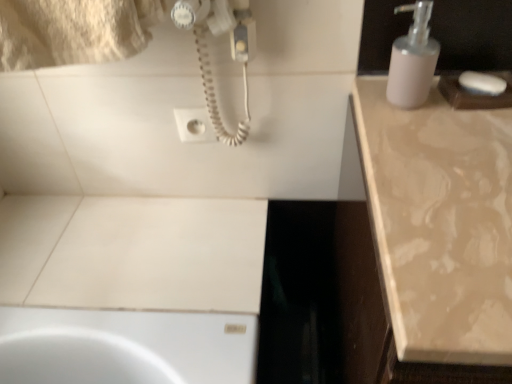
What is the approximate height of white matte soap at upper right?

white matte soap at upper right is 1.09 inches tall.

The width and height of the screenshot is (512, 384). Find the location of `white matte soap dispenser at upper right`. white matte soap dispenser at upper right is located at coordinates (413, 59).

Identify the location of white plastic socket at upper center. Image resolution: width=512 pixels, height=384 pixels. (194, 125).

Does white plastic socket at upper center have a greater width compared to beige marble countertop at right?

Incorrect, the width of white plastic socket at upper center does not surpass that of beige marble countertop at right.

Is white plastic socket at upper center oriented away from beige marble countertop at right?

white plastic socket at upper center does not have its back to beige marble countertop at right.

Is white plastic socket at upper center in front of or behind beige marble countertop at right in the image?

Visually, white plastic socket at upper center is located behind beige marble countertop at right.

Which is farther from the camera, [466,83] or [495,302]?

The point [466,83] is behind.

Are white matte soap at upper right and beige marble countertop at right making contact?

No, white matte soap at upper right is not making contact with beige marble countertop at right.

The width and height of the screenshot is (512, 384). I want to click on soap behind the beige marble countertop at right, so click(482, 83).

Could beige marble countertop at right be considered to be inside white matte soap at upper right?

No, beige marble countertop at right is not surrounded by white matte soap at upper right.

From a real-world perspective, is white matte soap dispenser at upper right physically located above or below beige marble countertop at right?

In terms of real-world spatial position, white matte soap dispenser at upper right is above beige marble countertop at right.

Does white matte soap dispenser at upper right contain beige marble countertop at right?

No, white matte soap dispenser at upper right does not contain beige marble countertop at right.

Which object is wider, white matte soap dispenser at upper right or beige marble countertop at right?

With larger width is beige marble countertop at right.

Between white matte soap at upper right and white matte soap dispenser at upper right, which one has more height?

Standing taller between the two is white matte soap dispenser at upper right.

Is white matte soap at upper right in front of or behind white matte soap dispenser at upper right in the image?

Clearly, white matte soap at upper right is behind white matte soap dispenser at upper right.

From the image's perspective, is white matte soap at upper right above or below white matte soap dispenser at upper right?

Based on their image positions, white matte soap at upper right is located beneath white matte soap dispenser at upper right.

Could you tell me if white matte soap at upper right is facing white matte soap dispenser at upper right?

No, white matte soap at upper right is not facing towards white matte soap dispenser at upper right.

Considering the sizes of objects white matte soap at upper right and white plastic socket at upper center in the image provided, who is smaller, white matte soap at upper right or white plastic socket at upper center?

white plastic socket at upper center is smaller.

Is white matte soap at upper right positioned beyond the bounds of white plastic socket at upper center?

Indeed, white matte soap at upper right is completely outside white plastic socket at upper center.

Visually, is white matte soap at upper right positioned to the left or to the right of white plastic socket at upper center?

white matte soap at upper right is to the right of white plastic socket at upper center.

Is point (476, 75) positioned behind point (176, 120)?

No, (476, 75) is in front of (176, 120).

Is white plastic socket at upper center facing towards white matte soap at upper right?

No, white plastic socket at upper center is not oriented towards white matte soap at upper right.

From the image's perspective, is white plastic socket at upper center located above or below white matte soap at upper right?

From the image's perspective, white plastic socket at upper center appears below white matte soap at upper right.

Does white plastic socket at upper center have a greater width compared to white matte soap at upper right?

No.

Who is bigger, beige marble countertop at right or white plastic socket at upper center?

With larger size is beige marble countertop at right.

Is beige marble countertop at right next to white plastic socket at upper center and touching it?

No, beige marble countertop at right is not beside white plastic socket at upper center.

From the image's perspective, is beige marble countertop at right below white plastic socket at upper center?

Yes, from the image's perspective, beige marble countertop at right is below white plastic socket at upper center.

Does beige marble countertop at right have a lesser height compared to white plastic socket at upper center?

No.

This screenshot has width=512, height=384. Find the location of `countertop that appears on the right of white plastic socket at upper center`. countertop that appears on the right of white plastic socket at upper center is located at coordinates (440, 223).

You are a GUI agent. You are given a task and a screenshot of the screen. Output one action in this format:
    pyautogui.click(x=<x>, y=<y>)
    Task: Click on the soap on the left side of beige marble countertop at right
    The height and width of the screenshot is (384, 512).
    Given the screenshot: What is the action you would take?
    pyautogui.click(x=482, y=83)

Considering their positions, is white matte soap at upper right positioned further to beige marble countertop at right than white plastic socket at upper center?

white plastic socket at upper center.

Considering their positions, is white matte soap at upper right positioned closer to white plastic socket at upper center than white matte soap dispenser at upper right?

The object closer to white plastic socket at upper center is white matte soap dispenser at upper right.

Looking at this image, which object lies further to the anchor point white plastic socket at upper center, beige marble countertop at right or white matte soap dispenser at upper right?

beige marble countertop at right.

Considering their positions, is beige marble countertop at right positioned closer to white matte soap at upper right than white plastic socket at upper center?

beige marble countertop at right is closer to white matte soap at upper right.

When comparing their distances from white matte soap at upper right, does white plastic socket at upper center or beige marble countertop at right seem closer?

beige marble countertop at right.

Looking at the image, which one is located further to white plastic socket at upper center, white matte soap dispenser at upper right or beige marble countertop at right?

Among the two, beige marble countertop at right is located further to white plastic socket at upper center.

Considering their positions, is white plastic socket at upper center positioned further to beige marble countertop at right than white matte soap at upper right?

Based on the image, white plastic socket at upper center appears to be further to beige marble countertop at right.

Which object lies further to the anchor point beige marble countertop at right, white matte soap dispenser at upper right or white plastic socket at upper center?

white plastic socket at upper center.

I want to click on soap between white plastic socket at upper center and beige marble countertop at right in the horizontal direction, so click(x=482, y=83).

You are a GUI agent. You are given a task and a screenshot of the screen. Output one action in this format:
    pyautogui.click(x=<x>, y=<y>)
    Task: Click on the soap that lies between white matte soap dispenser at upper right and beige marble countertop at right from top to bottom
    
    Given the screenshot: What is the action you would take?
    pyautogui.click(x=482, y=83)

You are a GUI agent. You are given a task and a screenshot of the screen. Output one action in this format:
    pyautogui.click(x=<x>, y=<y>)
    Task: Click on the soap dispenser situated between white plastic socket at upper center and white matte soap at upper right from left to right
    This screenshot has height=384, width=512.
    Given the screenshot: What is the action you would take?
    pyautogui.click(x=413, y=59)

This screenshot has width=512, height=384. In order to click on soap dispenser between white plastic socket at upper center and beige marble countertop at right in the horizontal direction in this screenshot , I will do `click(413, 59)`.